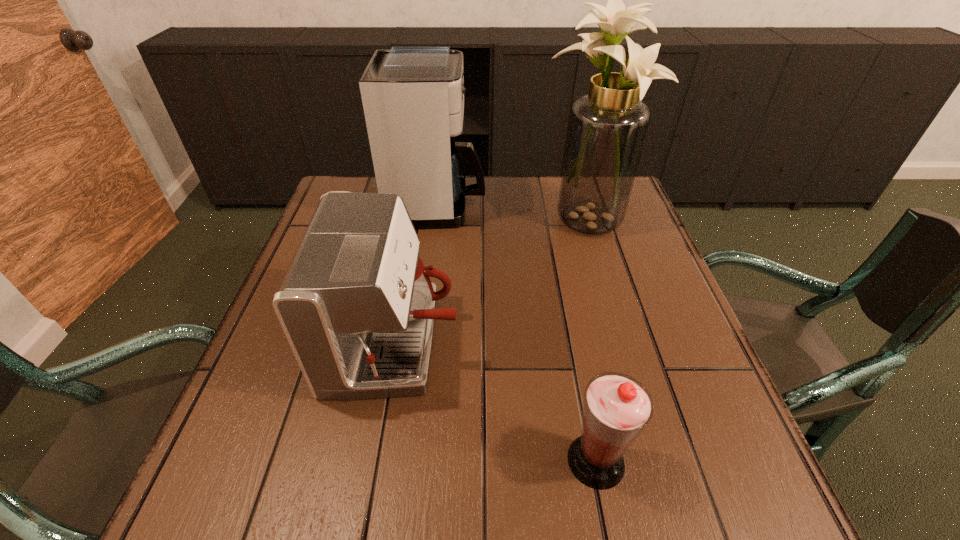
This screenshot has width=960, height=540. In the image, there is a desktop. In order to click on free space at the right edge in this screenshot , I will do `click(602, 248)`.

In the image, there is a desktop. Where is `vacant space at the near left corner`? Image resolution: width=960 pixels, height=540 pixels. vacant space at the near left corner is located at coordinates 271,517.

You are a GUI agent. You are given a task and a screenshot of the screen. Output one action in this format:
    pyautogui.click(x=<x>, y=<y>)
    Task: Click on the free spot between the smoothie and the second tallest object
    
    Given the screenshot: What is the action you would take?
    pyautogui.click(x=516, y=333)

Identify the location of free space between the shortest object and the farther coffee maker. This screenshot has height=540, width=960. (516, 333).

In order to click on free point between the nearer coffee maker and the smoothie in this screenshot , I will do `click(495, 402)`.

This screenshot has height=540, width=960. I want to click on free space between the farther coffee maker and the tallest object, so click(513, 214).

The image size is (960, 540). I want to click on blank region between the farther coffee maker and the nearest object, so click(x=516, y=333).

Where is `vacant area that lies between the nearest object and the tallest object`? The height and width of the screenshot is (540, 960). vacant area that lies between the nearest object and the tallest object is located at coordinates (591, 341).

The image size is (960, 540). Identify the location of empty location between the shortest object and the tallest object. (591, 341).

This screenshot has height=540, width=960. Find the location of `free point between the shorter coffee maker and the flower arrangement`. free point between the shorter coffee maker and the flower arrangement is located at coordinates (492, 282).